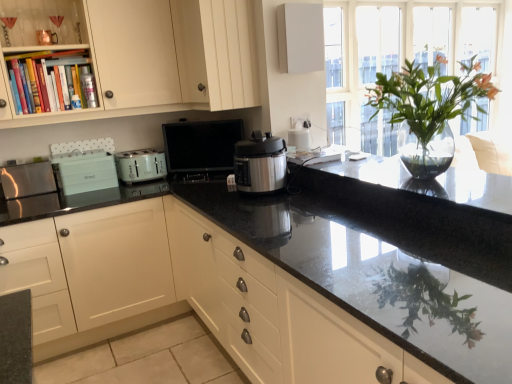
Where is `free space above matte teal toaster at left, positioned as the 2th appliance in right-to-left order (from a real-world perspective)`? The width and height of the screenshot is (512, 384). free space above matte teal toaster at left, positioned as the 2th appliance in right-to-left order (from a real-world perspective) is located at coordinates (77, 155).